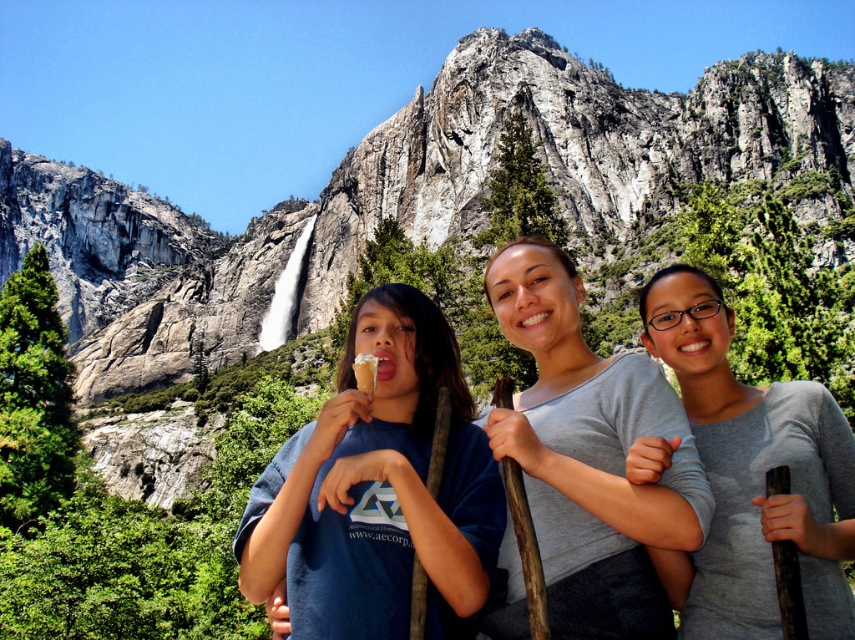
You are a photographer trying to capture a group photo of the gray cotton shirt at center and the gray matte shirt at center. Since you want both subjects to appear equally tall in the photo, which one should you move closer to the camera?

You should move closer to the gray matte shirt at center because it is shorter than the gray cotton shirt at center, so bringing it nearer will make them appear the same height in the photo.

You are a photographer trying to capture the gray matte shirt at center and the vanilla ice cream cone at center in the same frame. Which object should you focus on first to ensure both are in focus without moving the camera?

You should focus on the gray matte shirt at center first since it is larger than the vanilla ice cream cone at center, making it easier to achieve focus on the larger object before adjusting for the smaller one.